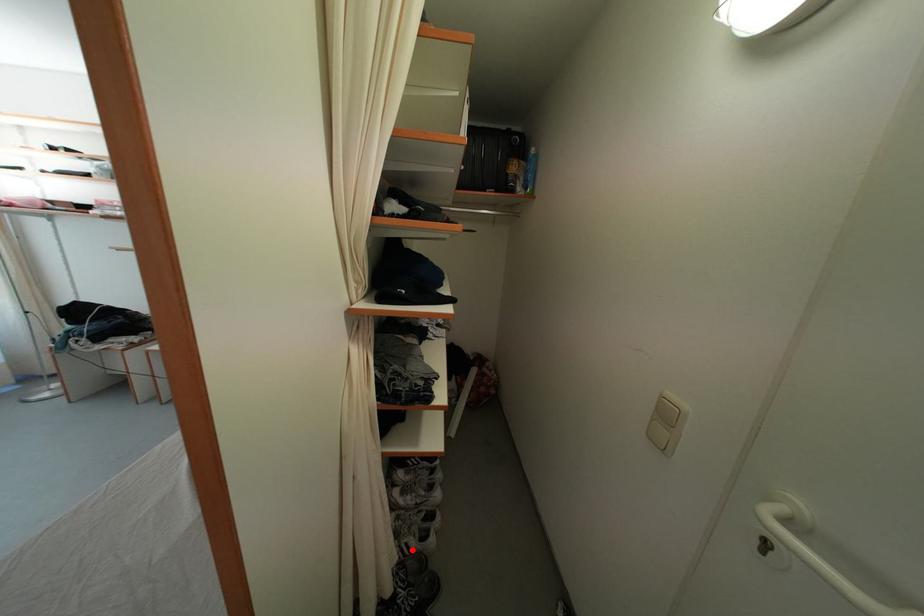
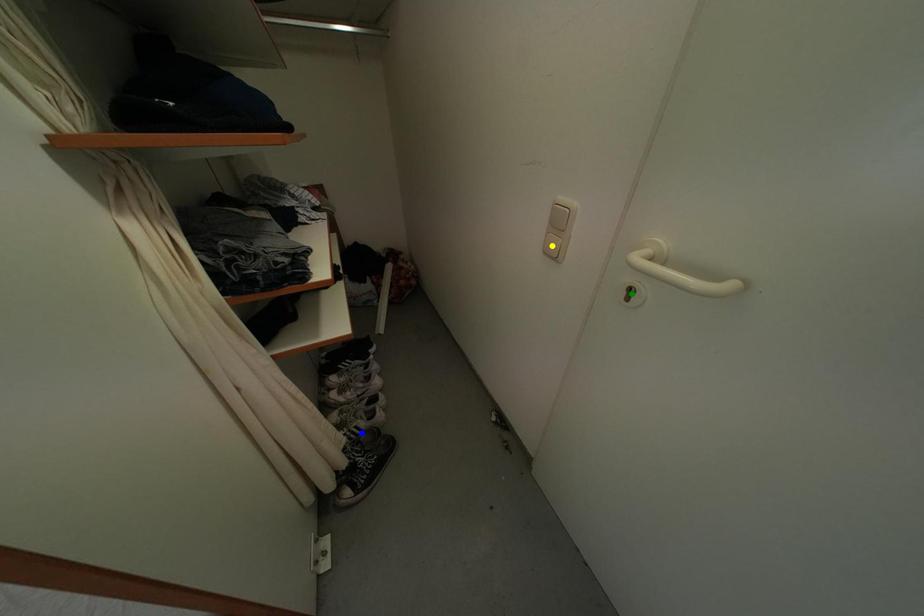
Question: I am providing you with two images of the same scene from different viewpoints. A red point is marked on the first image. You are given multiple points on the second image. Which point in image 2 represents the same 3d spot as the red point in image 1?

Choices:
 (A) blue point
 (B) yellow point
 (C) green point

Answer: (A)